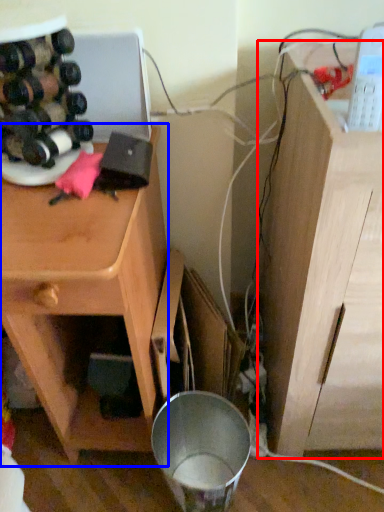
Question: Which object appears closest to the camera in this image, vanity (highlighted by a red box) or cabinetry (highlighted by a blue box)?

Choices:
 (A) vanity
 (B) cabinetry

Answer: (A)